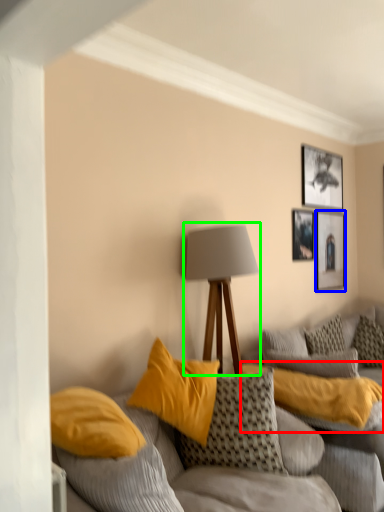
Question: Based on their relative distances, which object is farther from pillow (highlighted by a red box)? Choose from picture frame (highlighted by a blue box) and lamp (highlighted by a green box).

Choices:
 (A) picture frame
 (B) lamp

Answer: (A)